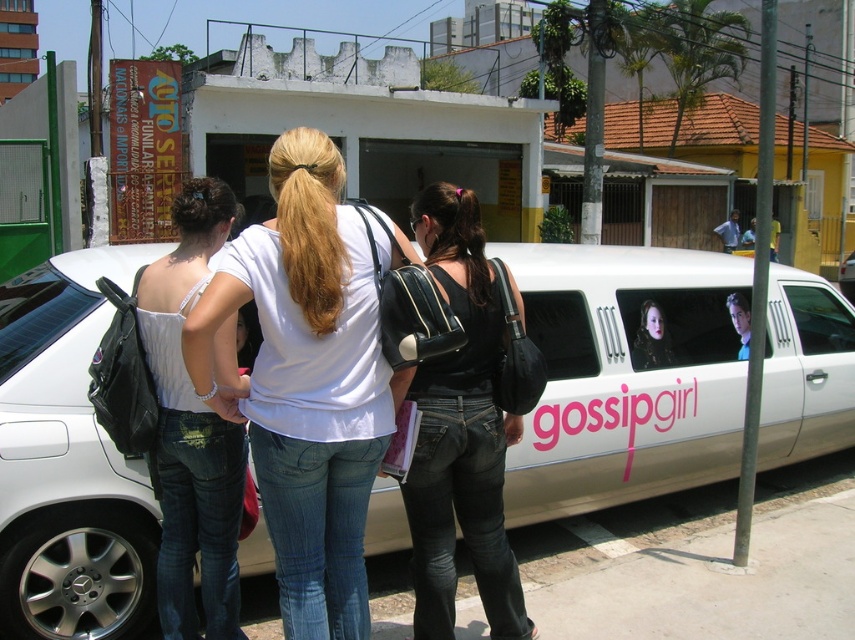
Does point (422, 484) lie in front of point (646, 301)?

Yes, point (422, 484) is in front of point (646, 301).

Who is more forward, (463, 220) or (641, 362)?

Point (463, 220) is more forward.

Locate an element on the screen. black leather backpack at center is located at coordinates (461, 433).

In the scene shown: Who is taller, white glossy limousine at center or white matte shirt at center?

white matte shirt at center is taller.

Is point (730, 356) in front of point (295, 257)?

No.

Between point (605, 497) and point (286, 269), which one is positioned behind?

The point (605, 497) is behind.

Locate an element on the screen. white glossy limousine at center is located at coordinates (626, 376).

Is white glossy limousine at center thinner than black leather backpack at center?

In fact, white glossy limousine at center might be wider than black leather backpack at center.

Can you confirm if white glossy limousine at center is positioned to the left of black leather backpack at center?

Incorrect, white glossy limousine at center is not on the left side of black leather backpack at center.

Between point (770, 348) and point (467, 244), which one is positioned in front?

Point (467, 244) is more forward.

Identify the location of white glossy limousine at center. The height and width of the screenshot is (640, 855). (626, 376).